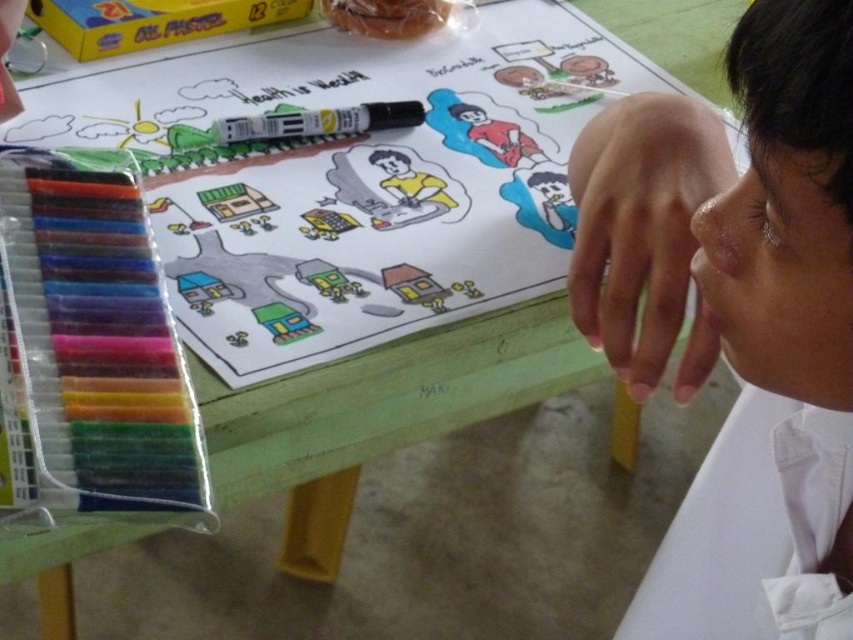
Question: Observing the image, what is the correct spatial positioning of white smooth skin at upper right in reference to black matte marker at center?

Choices:
 (A) left
 (B) right

Answer: (B)

Question: In this image, where is white smooth skin at upper right located relative to black matte marker at center?

Choices:
 (A) left
 (B) right

Answer: (B)

Question: Which of the following is the closest to the observer?

Choices:
 (A) (733, 60)
 (B) (338, 109)

Answer: (A)

Question: Does white smooth skin at upper right have a lesser width compared to black matte marker at center?

Choices:
 (A) no
 (B) yes

Answer: (B)

Question: Which point is closer to the camera?

Choices:
 (A) (711, 323)
 (B) (404, 115)

Answer: (A)